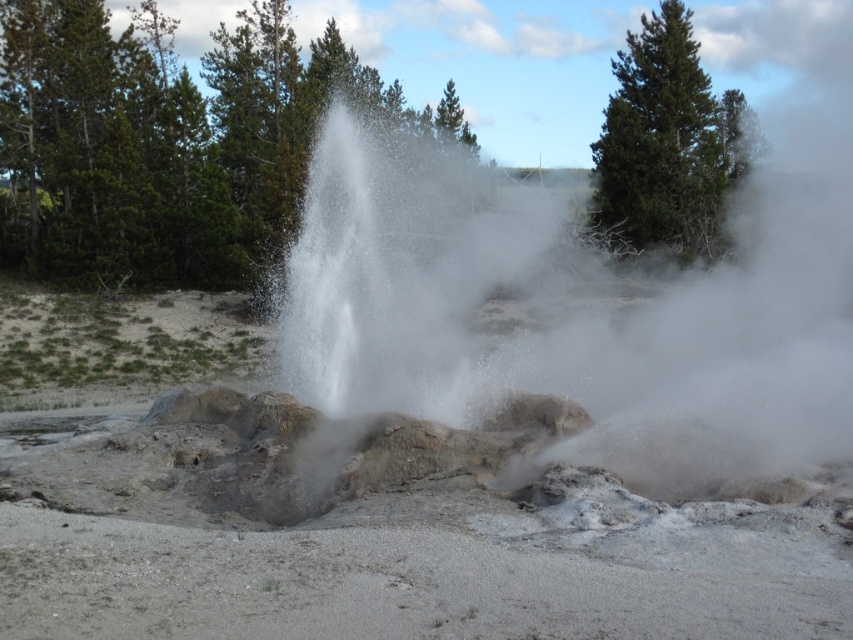
Question: Among these points, which one is nearest to the camera?

Choices:
 (A) (418, 349)
 (B) (697, 157)

Answer: (A)

Question: Among these objects, which one is nearest to the camera?

Choices:
 (A) green matte pine at upper right
 (B) white dusty steam at center

Answer: (B)

Question: In this image, where is white dusty steam at center located relative to green matte pine at upper right?

Choices:
 (A) below
 (B) above

Answer: (A)

Question: Among these points, which one is nearest to the camera?

Choices:
 (A) (575, 344)
 (B) (726, 189)

Answer: (A)

Question: Where is white dusty steam at center located in relation to green matte pine at upper right in the image?

Choices:
 (A) below
 (B) above

Answer: (A)

Question: Observing the image, what is the correct spatial positioning of white dusty steam at center in reference to green matte pine at upper right?

Choices:
 (A) above
 (B) below

Answer: (B)